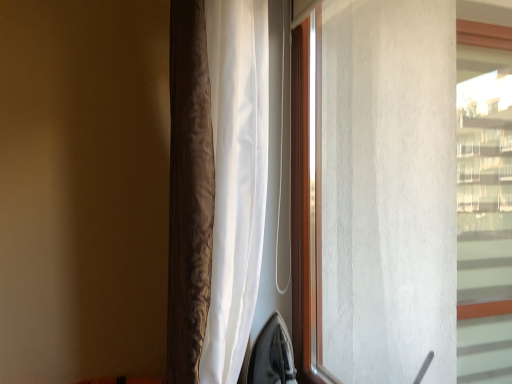
You are a GUI agent. You are given a task and a screenshot of the screen. Output one action in this format:
    pyautogui.click(x=<x>, y=<y>)
    Task: Click on the satin brown curtain at center
    This screenshot has height=384, width=512.
    Given the screenshot: What is the action you would take?
    pyautogui.click(x=236, y=178)

The height and width of the screenshot is (384, 512). Describe the element at coordinates (236, 178) in the screenshot. I see `satin brown curtain at center` at that location.

Locate an element on the screen. The width and height of the screenshot is (512, 384). satin brown curtain at center is located at coordinates (236, 178).